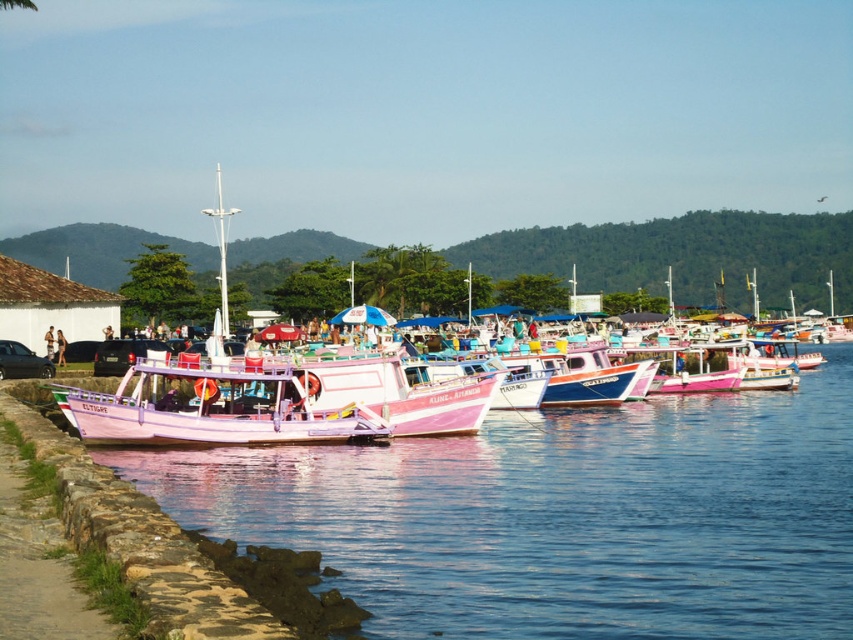
Based on the photo, you are standing at the water edge in the waterfront scene. There are two points marked in the image. The first point is at coordinate point (157, 410) and the second is at point (51, 333). Which point is nearer to you?

Point (157, 410) is closer to the viewer than point (51, 333).

You are standing on the stone embankment and want to take a photo of the pastel matte boat at center and the pink fabric person at center. Which object should you frame first in your camera to ensure both are in the shot?

You should frame the pink fabric person at center first because the pastel matte boat at center is positioned to the right of the pink fabric person at center, so starting with the person ensures the boat will be within the frame to the right.